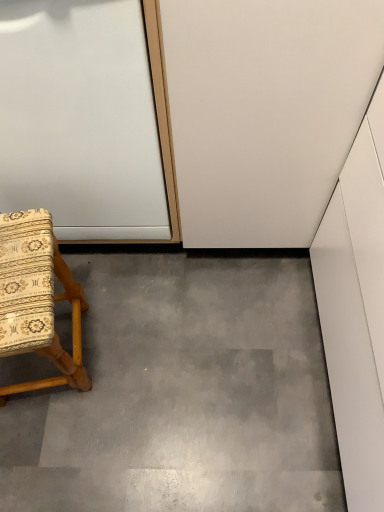
The height and width of the screenshot is (512, 384). I want to click on free space in front of wooden-patterned fabric chair at lower left, so click(x=65, y=449).